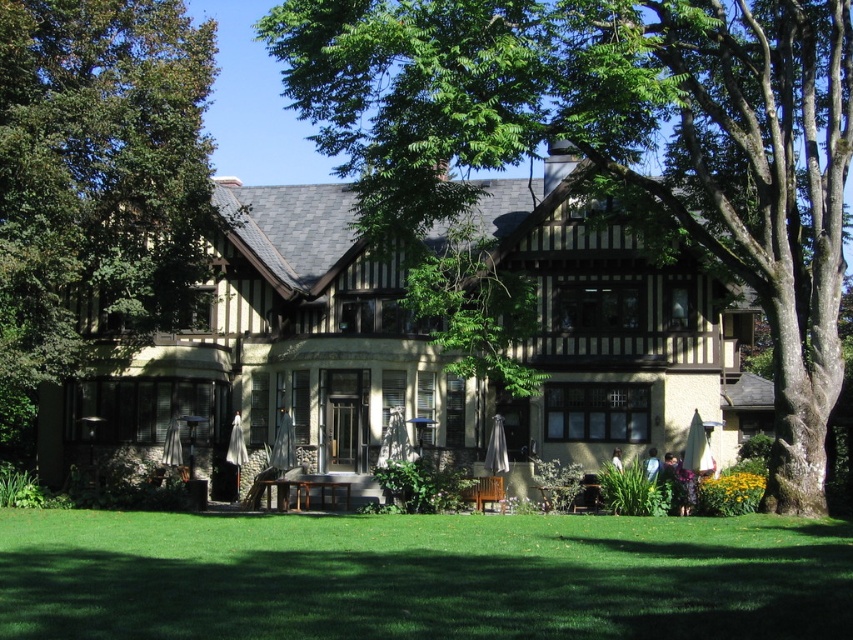
Question: Is green leafy tree at center to the right of green grass at lower center from the viewer's perspective?

Choices:
 (A) yes
 (B) no

Answer: (A)

Question: Does green leafy tree at center appear under green grass at lower center?

Choices:
 (A) yes
 (B) no

Answer: (B)

Question: Which object is farther from the camera taking this photo?

Choices:
 (A) green leafy tree at center
 (B) green leafy tree at left
 (C) green grass at lower center

Answer: (B)

Question: Can you confirm if green grass at lower center is positioned below green leafy tree at left?

Choices:
 (A) yes
 (B) no

Answer: (A)

Question: Among these objects, which one is farthest from the camera?

Choices:
 (A) green grass at lower center
 (B) green leafy tree at center
 (C) green leafy tree at left

Answer: (C)

Question: Which object is farther from the camera taking this photo?

Choices:
 (A) green leafy tree at center
 (B) green leafy tree at left
 (C) green grass at lower center

Answer: (B)